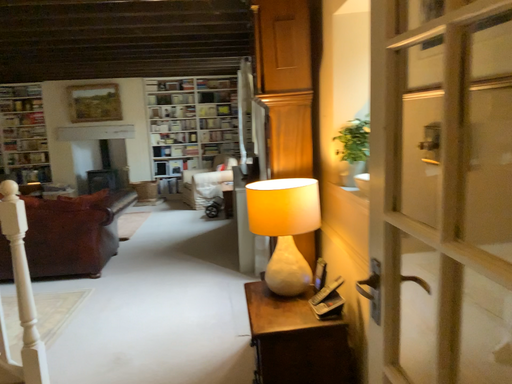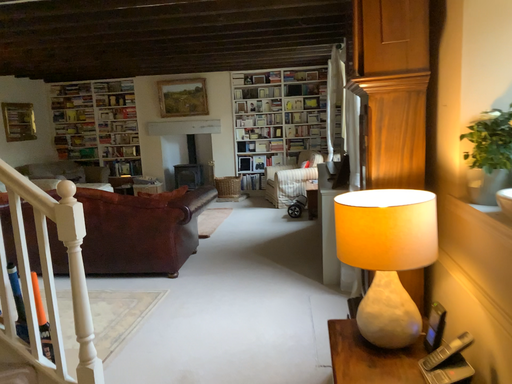
Question: How did the camera likely rotate when shooting the video?

Choices:
 (A) rotated right
 (B) rotated left

Answer: (B)